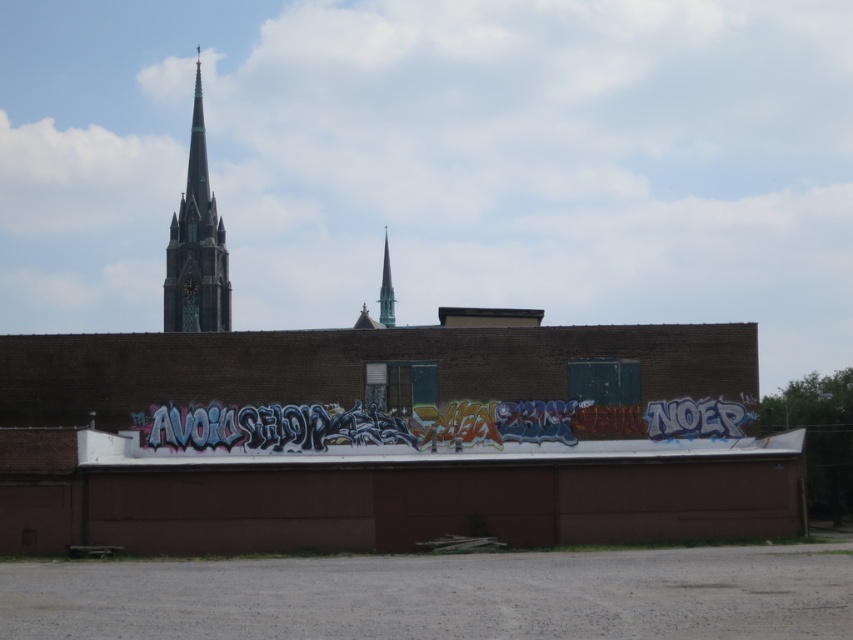
Question: Which is nearer to the dark green glass spire at upper left?

Choices:
 (A) smooth glass spire at center
 (B) multicolored graffiti at center

Answer: (A)

Question: Which object appears farthest from the camera in this image?

Choices:
 (A) dark green glass spire at upper left
 (B) multicolored graffiti at center

Answer: (A)

Question: Is dark green glass spire at upper left closer to camera compared to smooth glass spire at center?

Choices:
 (A) no
 (B) yes

Answer: (B)

Question: Is dark green glass spire at upper left closer to the viewer compared to smooth glass spire at center?

Choices:
 (A) yes
 (B) no

Answer: (A)

Question: Can you confirm if multicolored graffiti at center is smaller than dark green glass spire at upper left?

Choices:
 (A) no
 (B) yes

Answer: (B)

Question: Which point is closer to the camera?

Choices:
 (A) smooth glass spire at center
 (B) multicolored graffiti at center

Answer: (B)